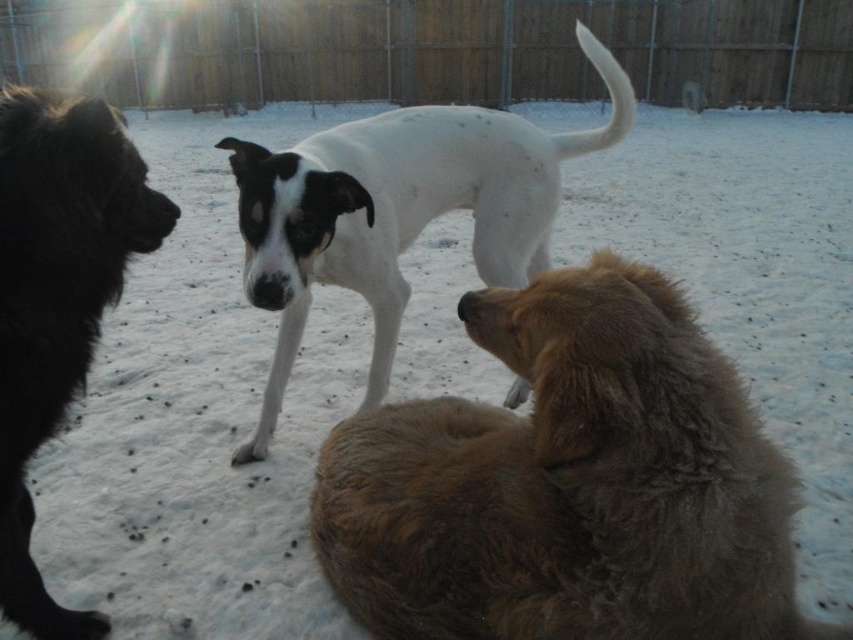
Question: Which object appears farthest from the camera in this image?

Choices:
 (A) fuzzy brown dog at lower right
 (B) black fluffy dog at left

Answer: (B)

Question: Does fuzzy brown dog at lower right come in front of black fluffy dog at left?

Choices:
 (A) yes
 (B) no

Answer: (A)

Question: Which object is the closest to the white smooth dog at center?

Choices:
 (A) fuzzy brown dog at lower right
 (B) black fluffy dog at left

Answer: (B)

Question: Is fuzzy brown dog at lower right bigger than black fluffy dog at left?

Choices:
 (A) yes
 (B) no

Answer: (A)

Question: Which object is the closest to the white smooth dog at center?

Choices:
 (A) black fluffy dog at left
 (B) fuzzy brown dog at lower right

Answer: (A)

Question: Can you confirm if white smooth dog at center is positioned to the right of black fluffy dog at left?

Choices:
 (A) yes
 (B) no

Answer: (A)